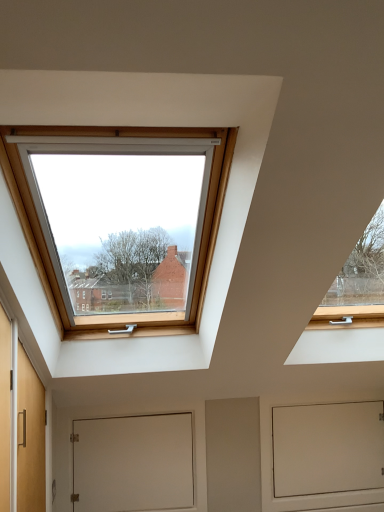
The height and width of the screenshot is (512, 384). Identify the location of white matte door at center. (133, 463).

The height and width of the screenshot is (512, 384). Describe the element at coordinates (133, 463) in the screenshot. I see `white matte door at center` at that location.

In order to face white matte screen door at lower center, should I rotate leftwards or rightwards?

To align with it, rotate right about 17.394°.

What do you see at coordinates (327, 454) in the screenshot? I see `white matte screen door at lower center` at bounding box center [327, 454].

Identify the location of white matte screen door at lower center. Image resolution: width=384 pixels, height=512 pixels. (327, 454).

Find the location of `white matte door at center`. white matte door at center is located at coordinates (133, 463).

Which is more to the left, white matte door at center or white matte screen door at lower center?

white matte door at center is more to the left.

In the image, is white matte door at center positioned in front of or behind white matte screen door at lower center?

white matte door at center is positioned closer to the viewer than white matte screen door at lower center.

Between point (136, 418) and point (319, 480), which one is positioned behind?

The point (319, 480) is farther.

From the image's perspective, is white matte door at center on white matte screen door at lower center?

Yes.

From a real-world perspective, who is located higher, white matte door at center or white matte screen door at lower center?

In real-world perspective, white matte door at center is above.

Looking at their sizes, would you say white matte door at center is wider or thinner than white matte screen door at lower center?

Considering their sizes, white matte door at center looks slimmer than white matte screen door at lower center.

From their relative heights in the image, would you say white matte door at center is taller or shorter than white matte screen door at lower center?

white matte door at center is shorter than white matte screen door at lower center.

Which of these two, white matte door at center or white matte screen door at lower center, is smaller?

white matte door at center.

Is white matte door at center situated inside white matte screen door at lower center or outside?

white matte door at center is outside white matte screen door at lower center.

Is white matte door at center next to white matte screen door at lower center?

No.

Is white matte door at center oriented towards white matte screen door at lower center?

No, white matte door at center is not facing towards white matte screen door at lower center.

Where is `screen door on the right of white matte door at center`? screen door on the right of white matte door at center is located at coordinates (327, 454).

In the scene shown: Can you confirm if white matte screen door at lower center is positioned to the right of white matte door at center?

Yes, white matte screen door at lower center is to the right of white matte door at center.

Between white matte screen door at lower center and white matte door at center, which one is positioned in front?

white matte door at center is closer to the camera.

Is point (357, 470) positioned in front of point (187, 464)?

No, (357, 470) is behind (187, 464).

From the image's perspective, is white matte screen door at lower center beneath white matte door at center?

Indeed, from the image's perspective, white matte screen door at lower center is shown beneath white matte door at center.

From a real-world perspective, is white matte screen door at lower center positioned above or below white matte door at center?

white matte screen door at lower center is situated lower than white matte door at center in the real world.

Between white matte screen door at lower center and white matte door at center, which one has smaller width?

white matte door at center.

Does white matte screen door at lower center have a greater height compared to white matte door at center?

Yes, white matte screen door at lower center is taller than white matte door at center.

Who is bigger, white matte screen door at lower center or white matte door at center?

Bigger between the two is white matte screen door at lower center.

Is white matte screen door at lower center completely or partially outside of white matte door at center?

Yes, white matte screen door at lower center is not within white matte door at center.

Is white matte screen door at lower center not near white matte door at center?

No, white matte screen door at lower center is in close proximity to white matte door at center.

Looking at this image, does white matte screen door at lower center turn towards white matte door at center?

No, white matte screen door at lower center is not facing towards white matte door at center.

Measure the distance from white matte screen door at lower center to white matte door at center.

white matte screen door at lower center and white matte door at center are 34.75 inches apart from each other.

Identify the location of door lying above the white matte screen door at lower center (from the image's perspective). This screenshot has width=384, height=512. (133, 463).

Find the location of a particular element. Image resolution: width=384 pixels, height=512 pixels. screen door on the right of the white matte door at center is located at coordinates (327, 454).

Find the location of a particular element. The image size is (384, 512). screen door located below the white matte door at center (from the image's perspective) is located at coordinates (327, 454).